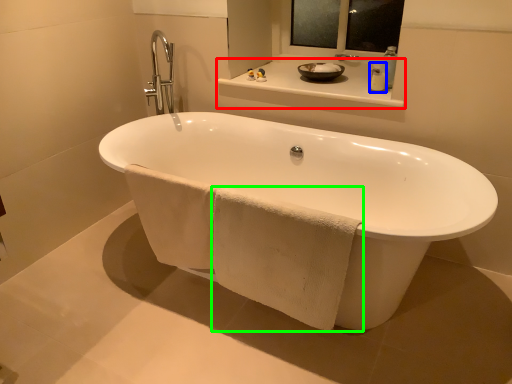
Question: Which object is positioned closest to counter top (highlighted by a red box)? Select from soap dispenser (highlighted by a blue box) and bath towel (highlighted by a green box).

Choices:
 (A) soap dispenser
 (B) bath towel

Answer: (A)